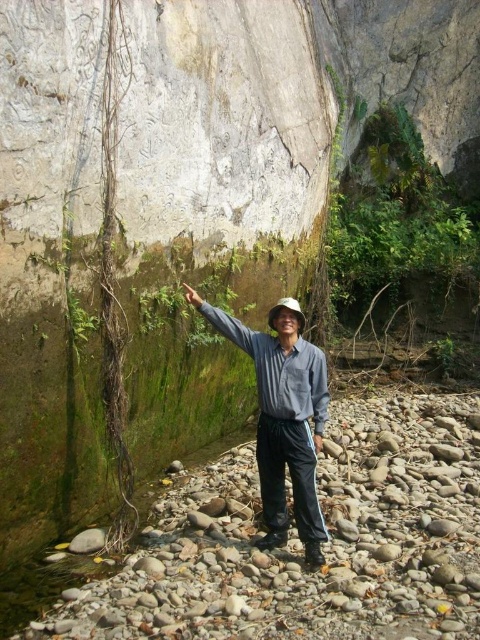
Question: Can you confirm if gray smooth rocks at lower right is positioned to the right of gray cotton shirt at center?

Choices:
 (A) no
 (B) yes

Answer: (A)

Question: Can you confirm if gray smooth rocks at lower right is positioned to the right of gray cotton shirt at center?

Choices:
 (A) no
 (B) yes

Answer: (A)

Question: Which point is farther to the camera?

Choices:
 (A) gray cotton shirt at center
 (B) gray smooth rocks at lower right

Answer: (A)

Question: Does gray smooth rocks at lower right appear over gray cotton shirt at center?

Choices:
 (A) no
 (B) yes

Answer: (A)